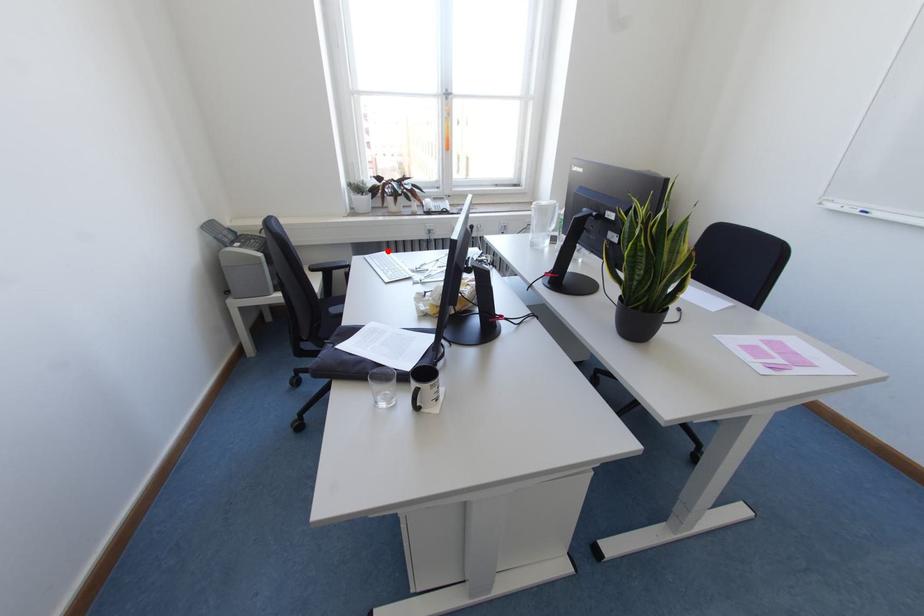
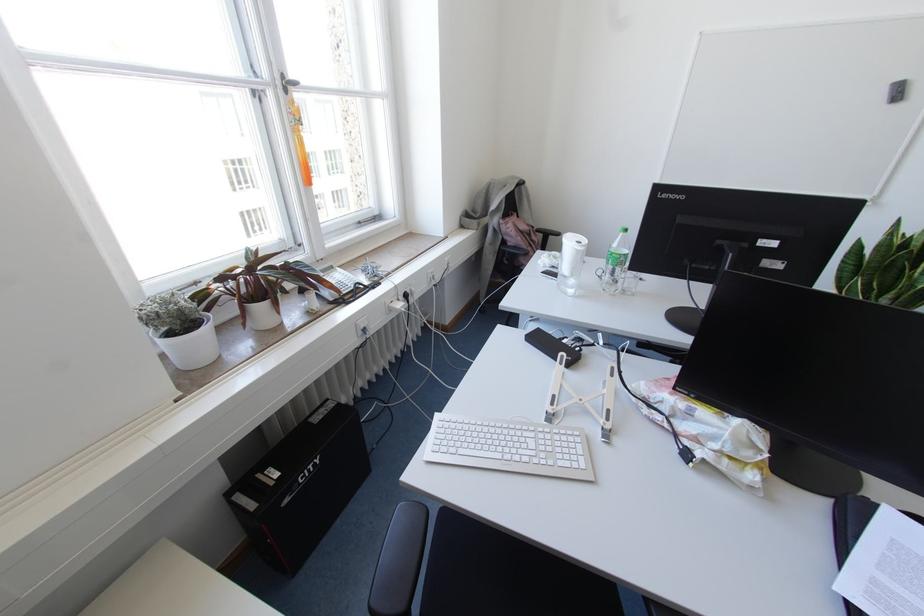
Where in the second image is the point corresponding to the highlighted location from the first image?

(435, 414)